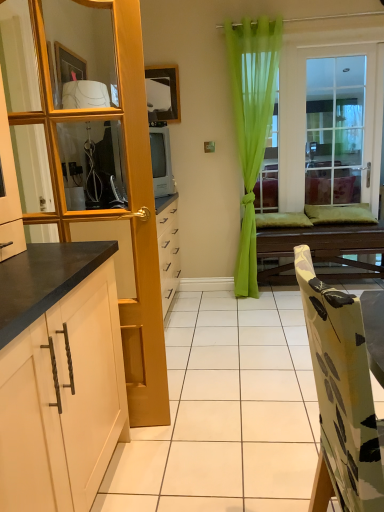
Question: Is the surface of wooden table at center in direct contact with green sheer curtain at center?

Choices:
 (A) yes
 (B) no

Answer: (B)

Question: From the image's perspective, is wooden table at center located above green sheer curtain at center?

Choices:
 (A) yes
 (B) no

Answer: (B)

Question: Is wooden table at center smaller than green sheer curtain at center?

Choices:
 (A) yes
 (B) no

Answer: (B)

Question: From a real-world perspective, is wooden table at center beneath green sheer curtain at center?

Choices:
 (A) yes
 (B) no

Answer: (A)

Question: Can you confirm if wooden table at center is shorter than green sheer curtain at center?

Choices:
 (A) no
 (B) yes

Answer: (B)

Question: Is green sheer curtain at center at the back of wooden table at center?

Choices:
 (A) no
 (B) yes

Answer: (A)

Question: Is green sheer curtain at center looking in the opposite direction of floral fabric chair at lower right?

Choices:
 (A) no
 (B) yes

Answer: (A)

Question: Is green sheer curtain at center far from floral fabric chair at lower right?

Choices:
 (A) no
 (B) yes

Answer: (B)

Question: Can floral fabric chair at lower right be found inside green sheer curtain at center?

Choices:
 (A) no
 (B) yes

Answer: (A)

Question: Is green sheer curtain at center at the right side of floral fabric chair at lower right?

Choices:
 (A) yes
 (B) no

Answer: (A)

Question: Can you confirm if green sheer curtain at center is smaller than floral fabric chair at lower right?

Choices:
 (A) no
 (B) yes

Answer: (A)

Question: Considering the relative positions of green sheer curtain at center and floral fabric chair at lower right in the image provided, is green sheer curtain at center behind floral fabric chair at lower right?

Choices:
 (A) yes
 (B) no

Answer: (A)

Question: From a real-world perspective, does clear glass window at center sit lower than clear glass mirror at upper left?

Choices:
 (A) yes
 (B) no

Answer: (A)